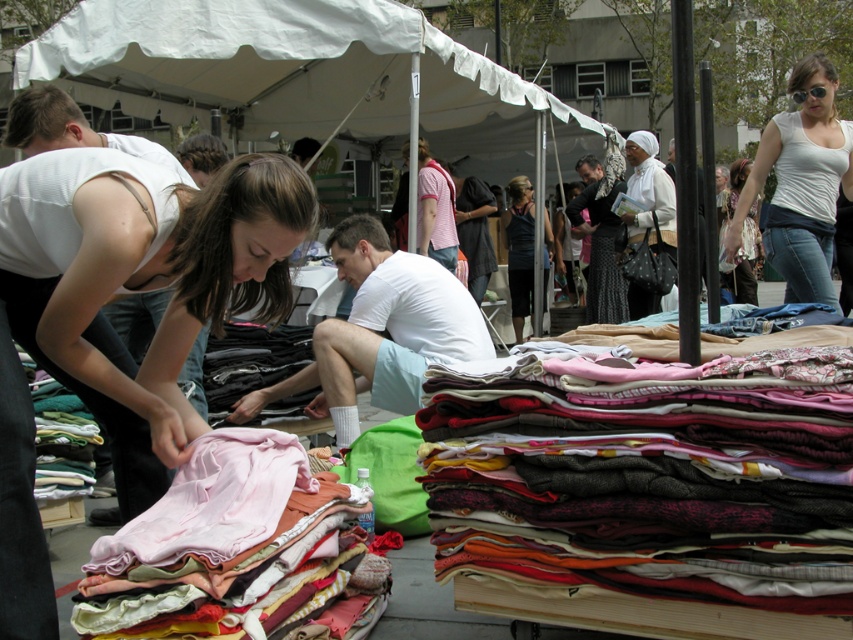
Question: Can you confirm if white matte tank top at upper right is bigger than striped cotton shirt at center?

Choices:
 (A) no
 (B) yes

Answer: (B)

Question: Based on their relative distances, which object is nearer to the pink fabric at lower left?

Choices:
 (A) matte black shirt at center
 (B) dark blue dress at center
 (C) white matte scarf at upper center
 (D) pink fabric at center

Answer: (D)

Question: Considering the real-world distances, which object is farthest from the white cotton shirt at center?

Choices:
 (A) striped cotton shirt at center
 (B) pink fabric at center
 (C) multicolored fabric stack at center

Answer: (A)

Question: In this image, where is white matte tank top at upper right located relative to matte white tank top at upper right?

Choices:
 (A) above
 (B) below

Answer: (B)

Question: Which object appears closest to the camera in this image?

Choices:
 (A) white cotton shorts at center
 (B) white matte scarf at upper center
 (C) white matte tank top at upper right

Answer: (A)

Question: Is multicolored fabric stack at center bigger than pink fabric at lower left?

Choices:
 (A) yes
 (B) no

Answer: (A)